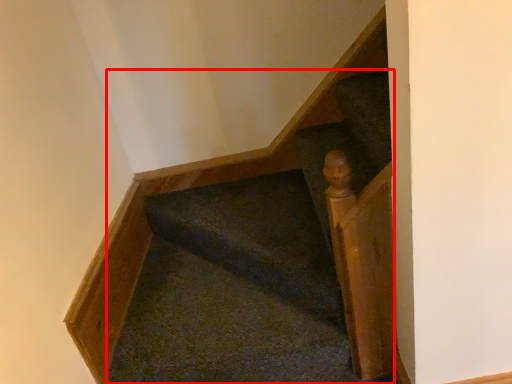
Question: From the image's perspective, considering the relative positions of stairs (annotated by the red box) and rail in the image provided, where is stairs (annotated by the red box) located with respect to the staircase?

Choices:
 (A) below
 (B) above

Answer: (B)